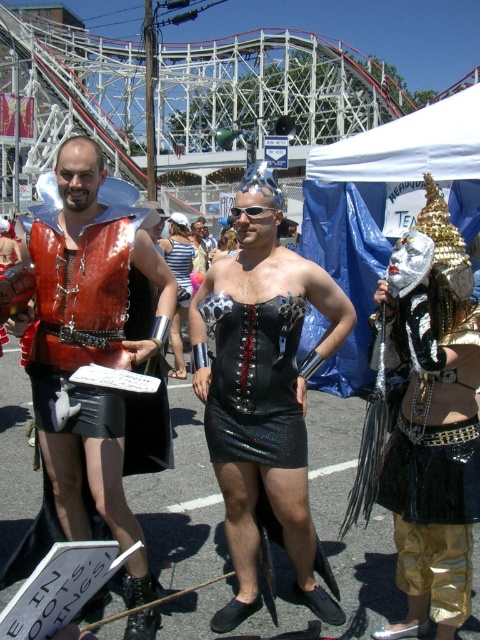
Does shiny leather vest at center have a greater width compared to black leather dress at center?

Indeed, shiny leather vest at center has a greater width compared to black leather dress at center.

Does shiny leather vest at center appear on the left side of black leather dress at center?

Indeed, shiny leather vest at center is positioned on the left side of black leather dress at center.

What do you see at coordinates (94, 362) in the screenshot? I see `shiny leather vest at center` at bounding box center [94, 362].

Image resolution: width=480 pixels, height=640 pixels. What are the coordinates of `shiny leather vest at center` in the screenshot? It's located at (94, 362).

Between shiny black dress at center and metallic silver dress at center, which one appears on the right side from the viewer's perspective?

From the viewer's perspective, shiny black dress at center appears more on the right side.

Who is positioned more to the left, shiny black dress at center or metallic silver dress at center?

metallic silver dress at center

Between point (217, 388) and point (171, 349), which one is positioned in front?

Point (217, 388) is more forward.

This screenshot has width=480, height=640. I want to click on shiny black dress at center, so click(263, 390).

Between shiny leather vest at center and metallic silver dress at center, which one has more height?

shiny leather vest at center is taller.

Does point (99, 252) lie behind point (188, 253)?

That is False.

Locate an element on the screen. The image size is (480, 640). shiny leather vest at center is located at coordinates (94, 362).